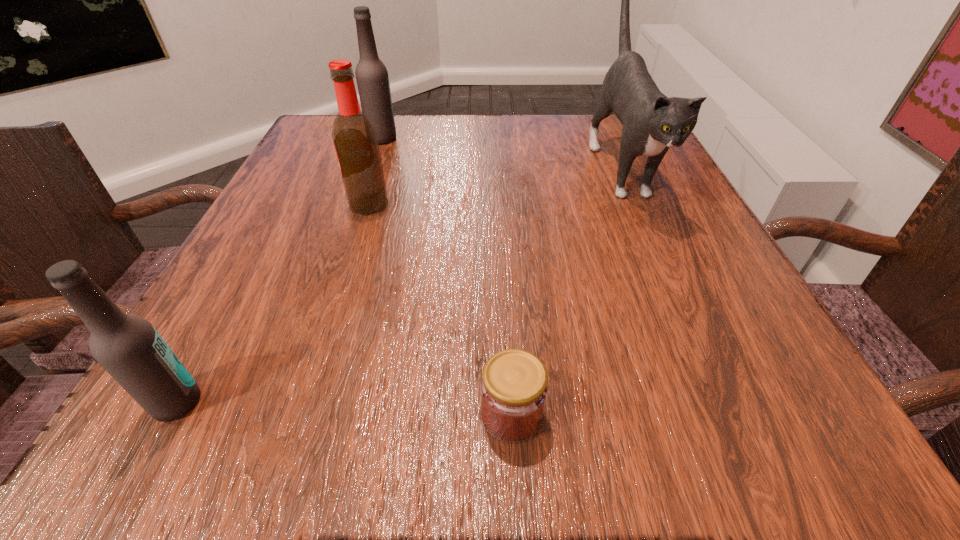
At what (x,y) coordinates should I click in order to perform the action: click on cat. Please return your answer as a coordinate pair (x, y). Looking at the image, I should click on (652, 123).

The height and width of the screenshot is (540, 960). In order to click on the farthest beer bottle in this screenshot , I will do `click(372, 78)`.

Where is `the second farthest beer bottle`? The height and width of the screenshot is (540, 960). the second farthest beer bottle is located at coordinates (355, 140).

At what (x,y) coordinates should I click in order to perform the action: click on the second shortest object. Please return your answer as a coordinate pair (x, y). The image size is (960, 540). Looking at the image, I should click on (128, 347).

This screenshot has height=540, width=960. I want to click on the leftmost beer bottle, so click(x=128, y=347).

Identify the location of jam. The width and height of the screenshot is (960, 540). (514, 388).

Identify the location of the shortest object. (514, 388).

What are the coordinates of `vacant point located at the face of the rightmost object` in the screenshot? It's located at (684, 308).

Where is `vacant space located on the side of the farthest beer bottle with the label`? The height and width of the screenshot is (540, 960). vacant space located on the side of the farthest beer bottle with the label is located at coordinates (556, 138).

You are a GUI agent. You are given a task and a screenshot of the screen. Output one action in this format:
    pyautogui.click(x=<x>, y=<y>)
    Task: Click on the free space located on the front of the second farthest beer bottle
    The image size is (960, 540).
    Given the screenshot: What is the action you would take?
    pyautogui.click(x=357, y=241)